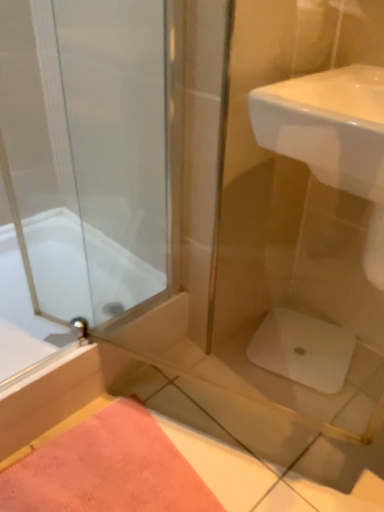
Question: Is white glossy sink at upper right positioned behind pink fabric bath mat at lower left?

Choices:
 (A) yes
 (B) no

Answer: (B)

Question: Does white glossy sink at upper right have a lesser width compared to pink fabric bath mat at lower left?

Choices:
 (A) yes
 (B) no

Answer: (A)

Question: Is white glossy sink at upper right placed right next to pink fabric bath mat at lower left?

Choices:
 (A) no
 (B) yes

Answer: (A)

Question: From the image's perspective, is white glossy sink at upper right located beneath pink fabric bath mat at lower left?

Choices:
 (A) no
 (B) yes

Answer: (A)

Question: Can you confirm if white glossy sink at upper right is shorter than pink fabric bath mat at lower left?

Choices:
 (A) yes
 (B) no

Answer: (B)

Question: In the image, is white glossy sink at upper right positioned in front of or behind white glossy bathtub at left?

Choices:
 (A) behind
 (B) front

Answer: (B)

Question: Is point (332, 170) closer or farther from the camera than point (59, 326)?

Choices:
 (A) farther
 (B) closer

Answer: (B)

Question: In terms of size, does white glossy sink at upper right appear bigger or smaller than white glossy bathtub at left?

Choices:
 (A) big
 (B) small

Answer: (B)

Question: Is white glossy sink at upper right inside the boundaries of white glossy bathtub at left, or outside?

Choices:
 (A) outside
 (B) inside

Answer: (A)

Question: Considering the positions of white glossy bathtub at left and white glossy sink at upper right in the image, is white glossy bathtub at left wider or thinner than white glossy sink at upper right?

Choices:
 (A) thin
 (B) wide

Answer: (B)

Question: Considering their positions, is white glossy bathtub at left located in front of or behind white glossy sink at upper right?

Choices:
 (A) front
 (B) behind

Answer: (B)

Question: From the image's perspective, is white glossy bathtub at left located above or below white glossy sink at upper right?

Choices:
 (A) above
 (B) below

Answer: (B)

Question: From a real-world perspective, is white glossy bathtub at left above or below white glossy sink at upper right?

Choices:
 (A) below
 (B) above

Answer: (A)

Question: Looking at the image, does white glossy sink at upper right seem bigger or smaller compared to pink fabric bath mat at lower left?

Choices:
 (A) big
 (B) small

Answer: (A)

Question: Considering the positions of white glossy sink at upper right and pink fabric bath mat at lower left in the image, is white glossy sink at upper right taller or shorter than pink fabric bath mat at lower left?

Choices:
 (A) tall
 (B) short

Answer: (A)